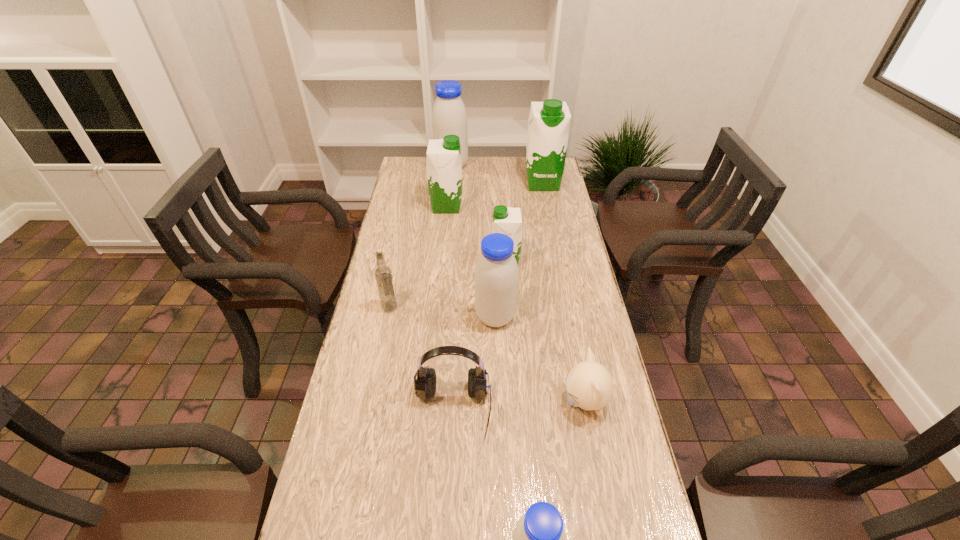
Find the location of a particular element. This screenshot has width=960, height=540. the sixth closest object to the shortest object is located at coordinates (443, 158).

You are a GUI agent. You are given a task and a screenshot of the screen. Output one action in this format:
    pyautogui.click(x=<x>, y=<y>)
    Task: Click on the object that is the fourth closest to the smallest blue soya milk
    This screenshot has width=960, height=540.
    Given the screenshot: What is the action you would take?
    pyautogui.click(x=383, y=274)

The image size is (960, 540). I want to click on soya milk that is the second closest to the second smallest blue soya milk, so click(443, 158).

You are a GUI agent. You are given a task and a screenshot of the screen. Output one action in this format:
    pyautogui.click(x=<x>, y=<y>)
    Task: Click on the soya milk identified as the second closest to the kitten
    
    Given the screenshot: What is the action you would take?
    pyautogui.click(x=538, y=539)

Choose which blue soya milk is the second nearest neighbor to the nearest blue soya milk. Please provide its 2D coordinates. Your answer should be formatted as a tuple, i.e. [(x, y)], where the tuple contains the x and y coordinates of a point satisfying the conditions above.

[(449, 117)]

Identify which blue soya milk is the second nearest to the farthest green soya milk. Please provide its 2D coordinates. Your answer should be formatted as a tuple, i.e. [(x, y)], where the tuple contains the x and y coordinates of a point satisfying the conditions above.

[(496, 275)]

Choose which green soya milk is the second nearest neighbor to the biggest blue soya milk. Please provide its 2D coordinates. Your answer should be formatted as a tuple, i.e. [(x, y)], where the tuple contains the x and y coordinates of a point satisfying the conditions above.

[(549, 122)]

What are the coordinates of `the closest green soya milk to the farthest green soya milk` in the screenshot? It's located at (443, 158).